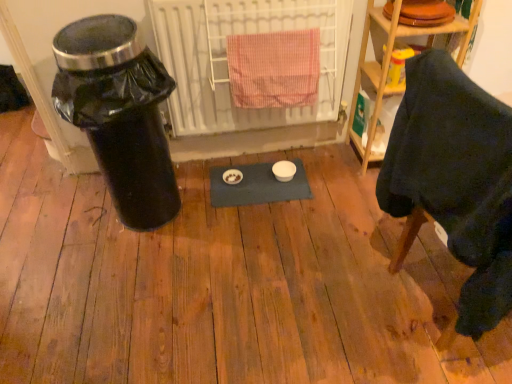
The height and width of the screenshot is (384, 512). Find the location of `free spot to the left of dark fabric chair at lower right`. free spot to the left of dark fabric chair at lower right is located at coordinates (336, 293).